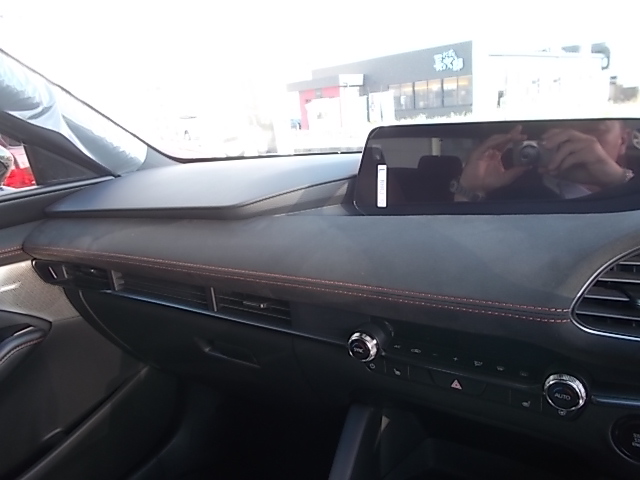
Identify the location of building window. (465, 90), (444, 92), (412, 97).